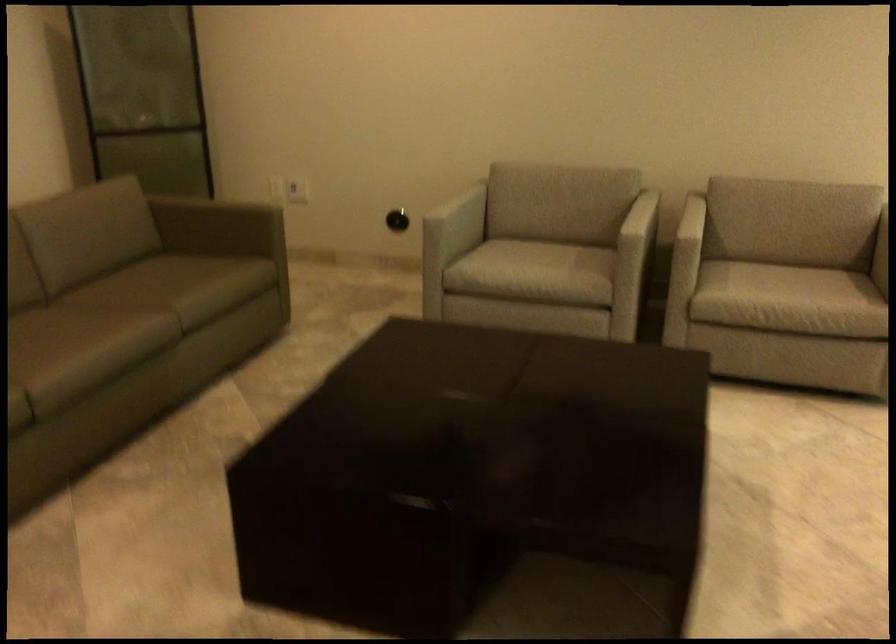
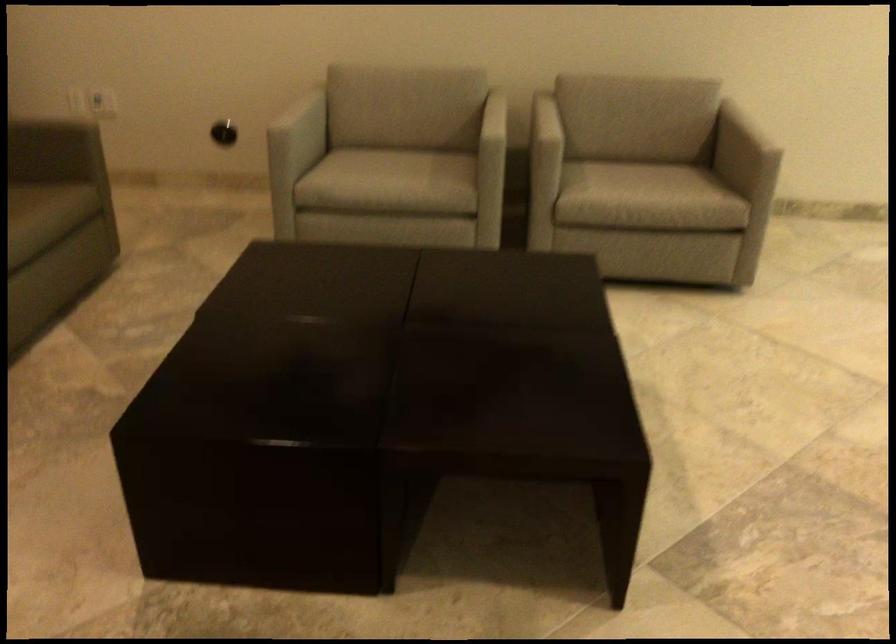
Where in the second image is the point corresponding to (x=626, y=247) from the first image?

(492, 151)